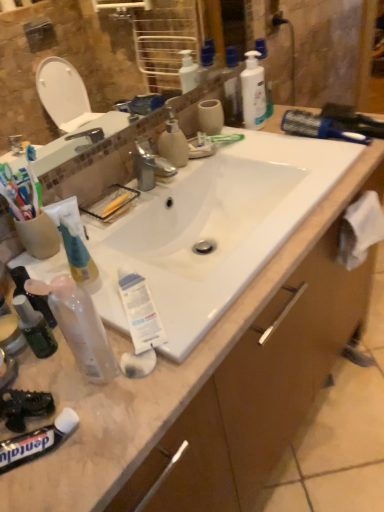
Locate an element on the screen. free space in front of white matte tube at center, which ranks as the second toothpaste in front-to-back order is located at coordinates [x=130, y=397].